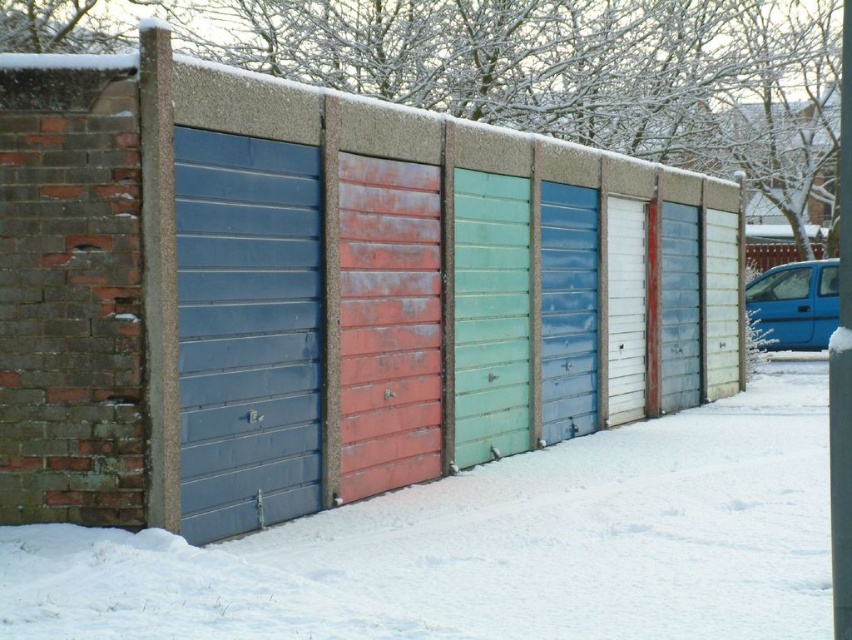
Between white powdery snow at lower center and metallic red fence at right, which one appears on the left side from the viewer's perspective?

Positioned to the left is white powdery snow at lower center.

Which is in front, point (616, 579) or point (755, 264)?

Point (616, 579) is in front.

The image size is (852, 640). Identify the location of white powdery snow at lower center. (493, 547).

Does point (801, 365) come closer to viewer compared to point (275, 380)?

No, it is behind (275, 380).

Who is more distant from viewer, (346, 628) or (202, 256)?

The point (202, 256) is behind.

Locate an element on the screen. white powdery snow at lower center is located at coordinates (493, 547).

I want to click on white powdery snow at lower center, so click(493, 547).

Is matte blue metal door at left behind metallic red fence at right?

No.

From the picture: Who is positioned more to the left, matte blue metal door at left or metallic red fence at right?

Positioned to the left is matte blue metal door at left.

I want to click on matte blue metal door at left, so click(x=246, y=332).

Locate an element on the screen. The image size is (852, 640). matte blue metal door at left is located at coordinates (246, 332).